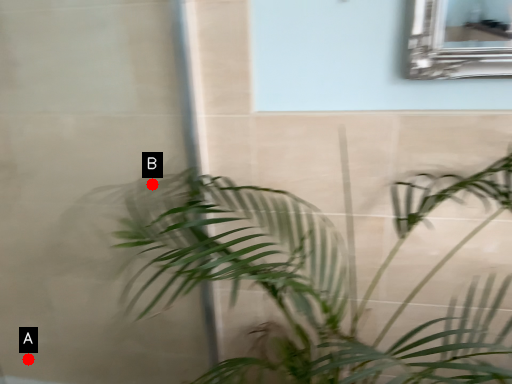
Question: Two points are circled on the image, labeled by A and B beside each circle. Which point is farther to the camera?

Choices:
 (A) A is further
 (B) B is further

Answer: (A)